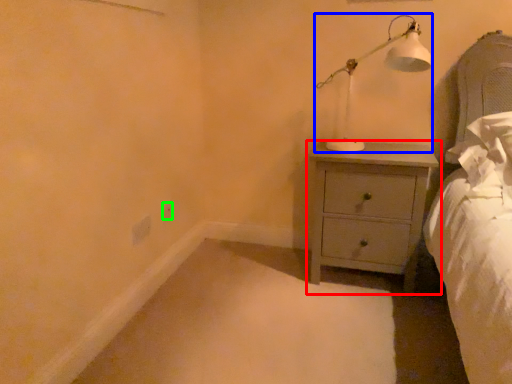
Question: Estimate the real-world distances between objects in this image. Which object is closer to chest of drawers (highlighted by a red box), table lamp (highlighted by a blue box) or electric outlet (highlighted by a green box)?

Choices:
 (A) table lamp
 (B) electric outlet

Answer: (A)